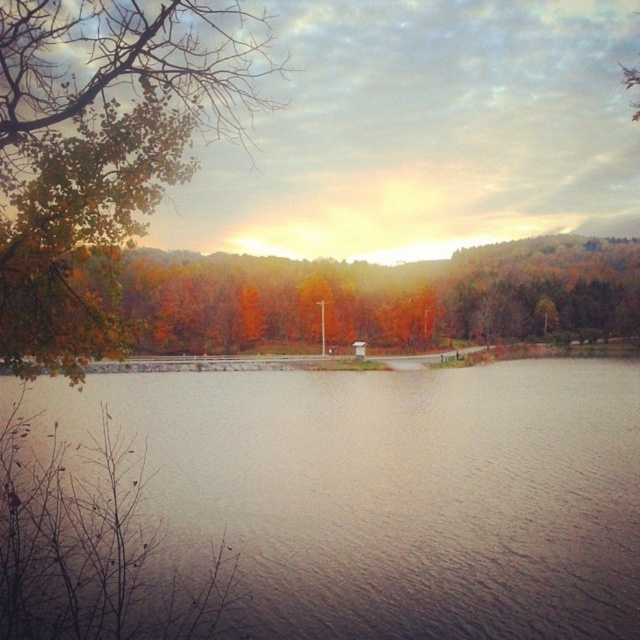
Who is positioned more to the left, green matte tree at upper left or autumn leaves at center?

From the viewer's perspective, green matte tree at upper left appears more on the left side.

Between point (72, 64) and point (518, 316), which one is positioned in front?

Point (72, 64)

Find the location of a particular element. Image resolution: width=640 pixels, height=640 pixels. green matte tree at upper left is located at coordinates (100, 150).

From the picture: Is smooth water at center shorter than green matte tree at upper left?

Correct, smooth water at center is not as tall as green matte tree at upper left.

Between smooth water at center and green matte tree at upper left, which one has less height?

smooth water at center

What are the coordinates of `smooth water at center` in the screenshot? It's located at (397, 492).

Which is behind, point (262, 593) or point (273, 292)?

Point (273, 292)

Locate an element on the screen. smooth water at center is located at coordinates (397, 492).